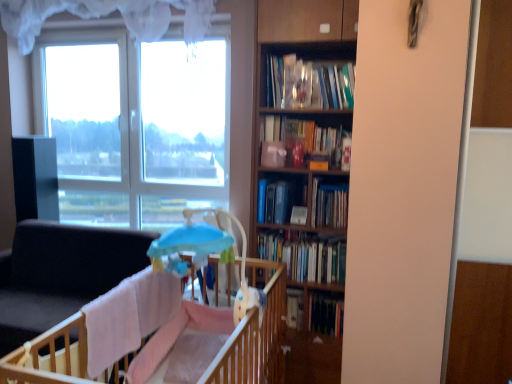
Question: Is wooden crib at lower left not close to light blue plastic baby carriage at center?

Choices:
 (A) yes
 (B) no

Answer: (B)

Question: From a real-world perspective, is wooden crib at lower left over light blue plastic baby carriage at center?

Choices:
 (A) no
 (B) yes

Answer: (A)

Question: Is light blue plastic baby carriage at center at the back of wooden crib at lower left?

Choices:
 (A) yes
 (B) no

Answer: (B)

Question: Can you confirm if wooden crib at lower left is taller than light blue plastic baby carriage at center?

Choices:
 (A) no
 (B) yes

Answer: (B)

Question: Does wooden crib at lower left contain light blue plastic baby carriage at center?

Choices:
 (A) yes
 (B) no

Answer: (B)

Question: Does wooden crib at lower left have a greater width compared to light blue plastic baby carriage at center?

Choices:
 (A) yes
 (B) no

Answer: (A)

Question: From a real-world perspective, does matte orange bookshelf at center, which is the 1th book in top-to-bottom order, stand above light blue plastic baby carriage at center?

Choices:
 (A) yes
 (B) no

Answer: (A)

Question: Is matte orange bookshelf at center, which is the 1th book in top-to-bottom order, positioned beyond the bounds of light blue plastic baby carriage at center?

Choices:
 (A) no
 (B) yes

Answer: (B)

Question: Considering the relative sizes of matte orange bookshelf at center, the fifth book positioned from the bottom, and light blue plastic baby carriage at center in the image provided, is matte orange bookshelf at center, the fifth book positioned from the bottom, shorter than light blue plastic baby carriage at center?

Choices:
 (A) no
 (B) yes

Answer: (B)

Question: Considering the relative sizes of matte orange bookshelf at center, which is the 1th book in top-to-bottom order, and light blue plastic baby carriage at center in the image provided, is matte orange bookshelf at center, which is the 1th book in top-to-bottom order, smaller than light blue plastic baby carriage at center?

Choices:
 (A) yes
 (B) no

Answer: (A)

Question: Is matte orange bookshelf at center, the fifth book positioned from the bottom, taller than light blue plastic baby carriage at center?

Choices:
 (A) yes
 (B) no

Answer: (B)

Question: Is matte orange bookshelf at center, the fifth book positioned from the bottom, wider than light blue plastic baby carriage at center?

Choices:
 (A) no
 (B) yes

Answer: (A)

Question: Is light blue plastic baby carriage at center surrounded by wooden bookcase at center?

Choices:
 (A) no
 (B) yes

Answer: (A)